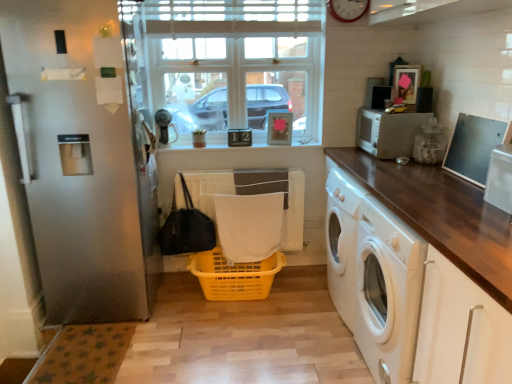
Locate an element on the screen. This screenshot has height=384, width=512. free location in front of yellow plastic basket at center is located at coordinates (237, 341).